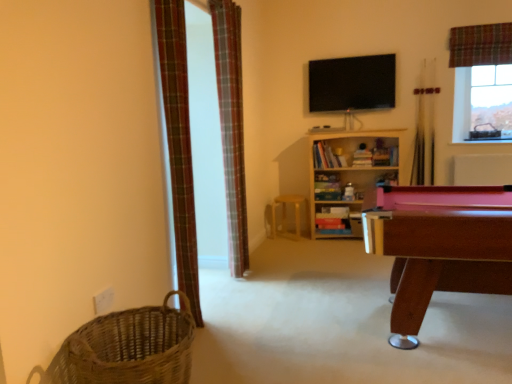
Question: From the image's perspective, does plaid fabric curtain at left, which is the 1th curtain in left-to-right order, appear higher than wooden pool table at right?

Choices:
 (A) no
 (B) yes

Answer: (B)

Question: Is wooden pool table at right inside plaid fabric curtain at left, which is the 1th curtain in left-to-right order?

Choices:
 (A) no
 (B) yes

Answer: (A)

Question: From a real-world perspective, is plaid fabric curtain at left, which is the 3th curtain in back-to-front order, on wooden pool table at right?

Choices:
 (A) yes
 (B) no

Answer: (A)

Question: Is plaid fabric curtain at left, which is the 1th curtain in left-to-right order, bigger than wooden pool table at right?

Choices:
 (A) no
 (B) yes

Answer: (A)

Question: Does plaid fabric curtain at left, which is the 3th curtain in back-to-front order, have a greater height compared to wooden pool table at right?

Choices:
 (A) yes
 (B) no

Answer: (A)

Question: Is wooden stool at center taller or shorter than plaid fabric curtain at center, the second curtain when ordered from front to back?

Choices:
 (A) tall
 (B) short

Answer: (B)

Question: Is wooden stool at center bigger or smaller than plaid fabric curtain at center, the 2th curtain viewed from the left?

Choices:
 (A) small
 (B) big

Answer: (A)

Question: Is wooden stool at center in front of or behind plaid fabric curtain at center, marked as the second curtain in a back-to-front arrangement, in the image?

Choices:
 (A) behind
 (B) front

Answer: (A)

Question: Based on their positions, is wooden stool at center located to the left or right of plaid fabric curtain at center, marked as the second curtain in a back-to-front arrangement?

Choices:
 (A) right
 (B) left

Answer: (A)

Question: Considering the positions of wooden bookshelf at center and plaid fabric curtain at center, the second curtain when ordered from front to back, in the image, is wooden bookshelf at center bigger or smaller than plaid fabric curtain at center, the second curtain when ordered from front to back,?

Choices:
 (A) small
 (B) big

Answer: (B)

Question: From a real-world perspective, is wooden bookshelf at center above or below plaid fabric curtain at center, positioned as the 2th curtain in right-to-left order?

Choices:
 (A) above
 (B) below

Answer: (B)

Question: From the image's perspective, is wooden bookshelf at center above or below plaid fabric curtain at center, the 2th curtain viewed from the left?

Choices:
 (A) above
 (B) below

Answer: (B)

Question: Considering the positions of wooden bookshelf at center and plaid fabric curtain at center, marked as the second curtain in a back-to-front arrangement, in the image, is wooden bookshelf at center taller or shorter than plaid fabric curtain at center, marked as the second curtain in a back-to-front arrangement,?

Choices:
 (A) tall
 (B) short

Answer: (B)

Question: Considering the positions of wooden stool at center and plaid fabric curtain at upper right, marked as the first curtain in a right-to-left arrangement, in the image, is wooden stool at center wider or thinner than plaid fabric curtain at upper right, marked as the first curtain in a right-to-left arrangement,?

Choices:
 (A) thin
 (B) wide

Answer: (B)

Question: Considering the positions of point [276, 205] and point [460, 49], is point [276, 205] closer or farther from the camera than point [460, 49]?

Choices:
 (A) farther
 (B) closer

Answer: (A)